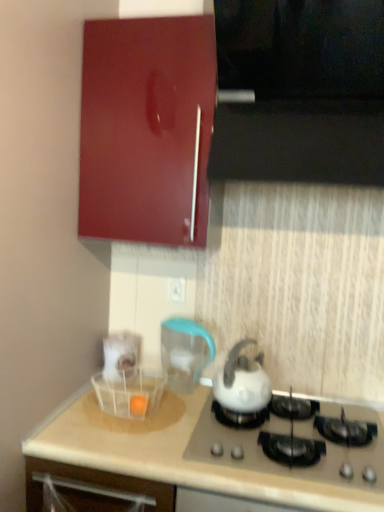
Identify the location of free space above white glossy gas stove at lower center (from a real-world perspective). The width and height of the screenshot is (384, 512). (296, 421).